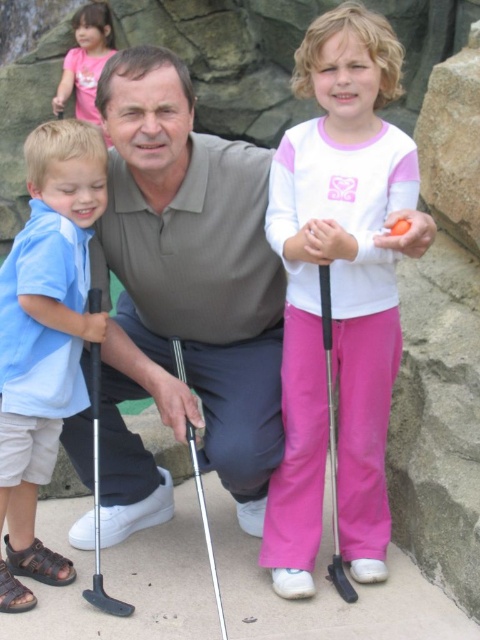
Is white matte golf club at center positioned in front of black plastic golf club at left?

Yes, white matte golf club at center is in front of black plastic golf club at left.

Is white matte golf club at center wider than black plastic golf club at left?

Yes, white matte golf club at center is wider than black plastic golf club at left.

Between point (276, 241) and point (97, 573), which one is positioned in front?

Point (276, 241) is more forward.

Where is `white matte golf club at center`? The width and height of the screenshot is (480, 640). white matte golf club at center is located at coordinates (338, 292).

Is blue cotton shirt at left smaller than pink cotton shirt at upper left?

Correct, blue cotton shirt at left occupies less space than pink cotton shirt at upper left.

What do you see at coordinates (46, 326) in the screenshot? I see `blue cotton shirt at left` at bounding box center [46, 326].

Between point (87, 173) and point (88, 120), which one is positioned in front?

Point (87, 173)

Where is `blue cotton shirt at left`? blue cotton shirt at left is located at coordinates (46, 326).

Does black plastic golf club at lower center have a lesser width compared to polished silver golf club at center?

Correct, black plastic golf club at lower center's width is less than polished silver golf club at center's.

Is point (327, 291) positioned after point (180, 376)?

No, it is in front of (180, 376).

This screenshot has height=640, width=480. In order to click on black plastic golf club at lower center in this screenshot , I will do `click(333, 440)`.